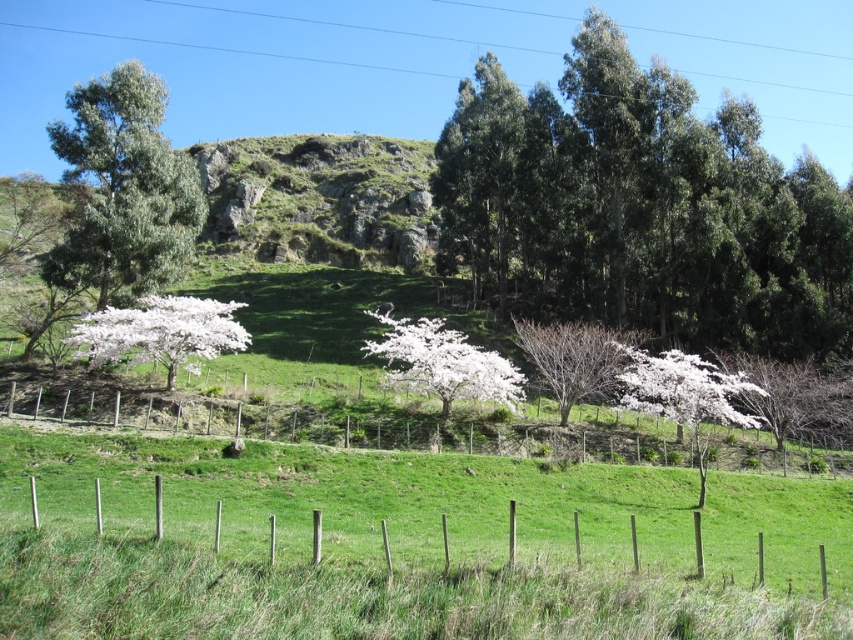
Question: Does wooden post fence at lower center have a larger size compared to white blossoms at left?

Choices:
 (A) no
 (B) yes

Answer: (A)

Question: Which point is closer to the camera?

Choices:
 (A) wooden posts at lower center
 (B) bare branches at center
 (C) green leafy trees at upper right
 (D) green leafy tree at left

Answer: (A)

Question: Which point is farther to the camera?

Choices:
 (A) (608, 364)
 (B) (630, 390)
 (C) (341, 442)
 (D) (537, 180)

Answer: (D)

Question: Considering the relative positions of green leafy trees at upper right and white blossoms at left in the image provided, where is green leafy trees at upper right located with respect to white blossoms at left?

Choices:
 (A) left
 (B) right

Answer: (B)

Question: Is green leafy trees at upper right below bare branches at center?

Choices:
 (A) yes
 (B) no

Answer: (B)

Question: Considering the real-world distances, which object is farthest from the green leafy tree at left?

Choices:
 (A) white blossoms at lower right
 (B) bare branches at center
 (C) wooden post fence at lower center
 (D) green leafy trees at upper right

Answer: (D)